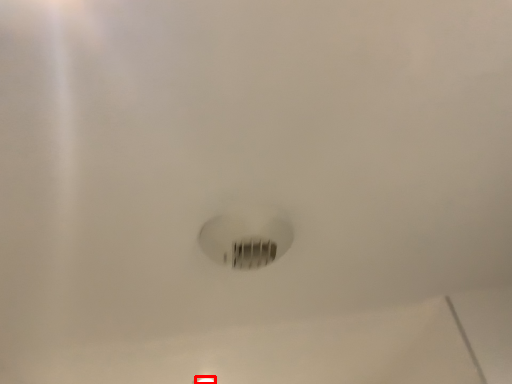
Question: From the image's perspective, where is light fixture (annotated by the red box) located relative to light bulb?

Choices:
 (A) above
 (B) below

Answer: (B)